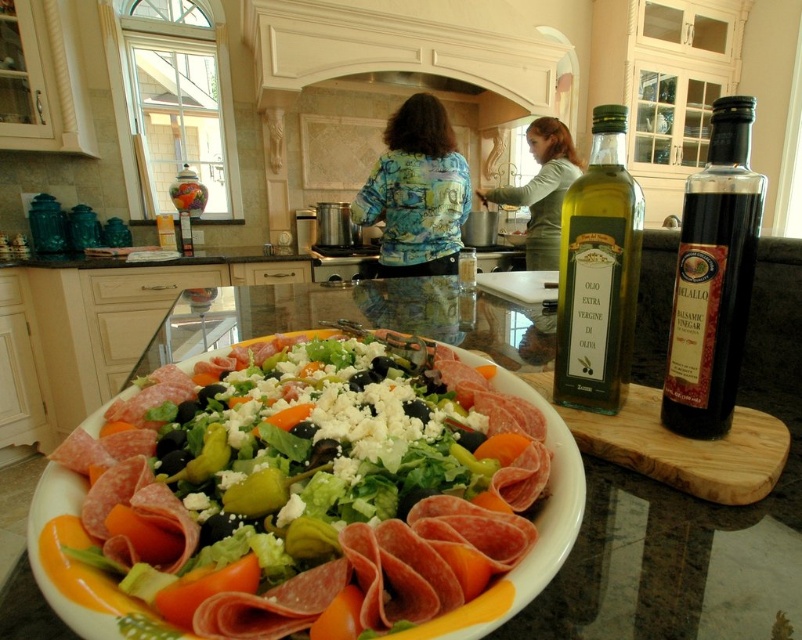
Who is positioned more to the left, salmon pink cured meat at center or green fabric shirt at center?

From the viewer's perspective, salmon pink cured meat at center appears more on the left side.

Is point (229, 596) closer to camera compared to point (549, 253)?

Yes, it is.

Image resolution: width=802 pixels, height=640 pixels. What are the coordinates of `salmon pink cured meat at center` in the screenshot? It's located at (312, 493).

Can you confirm if floral-patterned shirt at center is thinner than green fabric shirt at center?

In fact, floral-patterned shirt at center might be wider than green fabric shirt at center.

How much distance is there between floral-patterned shirt at center and green fabric shirt at center?

The distance of floral-patterned shirt at center from green fabric shirt at center is 20.42 inches.

Is point (419, 109) more distant than point (559, 209)?

No, (419, 109) is in front of (559, 209).

Find the location of a particular element. Image resolution: width=802 pixels, height=640 pixels. floral-patterned shirt at center is located at coordinates (416, 192).

Does salmon pink cured meat at center have a lesser height compared to green glass bottle at center?

Indeed, salmon pink cured meat at center has a lesser height compared to green glass bottle at center.

Can you confirm if salmon pink cured meat at center is smaller than green glass bottle at center?

No.

This screenshot has height=640, width=802. Find the location of `salmon pink cured meat at center`. salmon pink cured meat at center is located at coordinates pos(312,493).